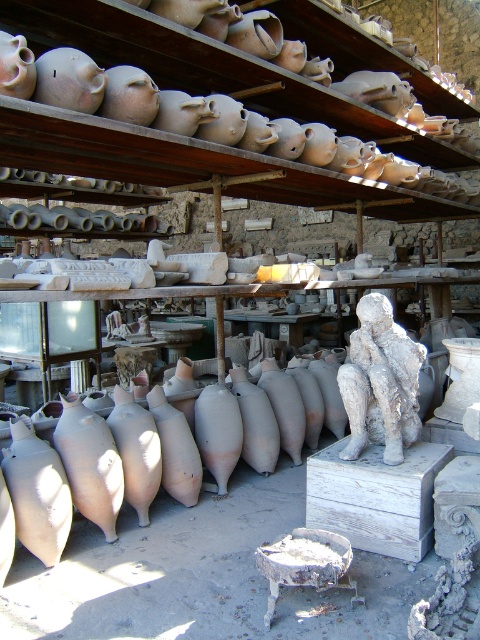
Looking at this image, does matte clay pots at upper center come behind white stone statue at center?

No, it is in front of white stone statue at center.

Does matte clay pots at upper center appear on the right side of white stone statue at center?

In fact, matte clay pots at upper center is to the left of white stone statue at center.

Who is more forward, (x=346, y=195) or (x=398, y=452)?

Point (x=398, y=452) is in front.

Find the location of a particular element. Image resolution: width=480 pixels, height=640 pixels. matte clay pots at upper center is located at coordinates (214, 70).